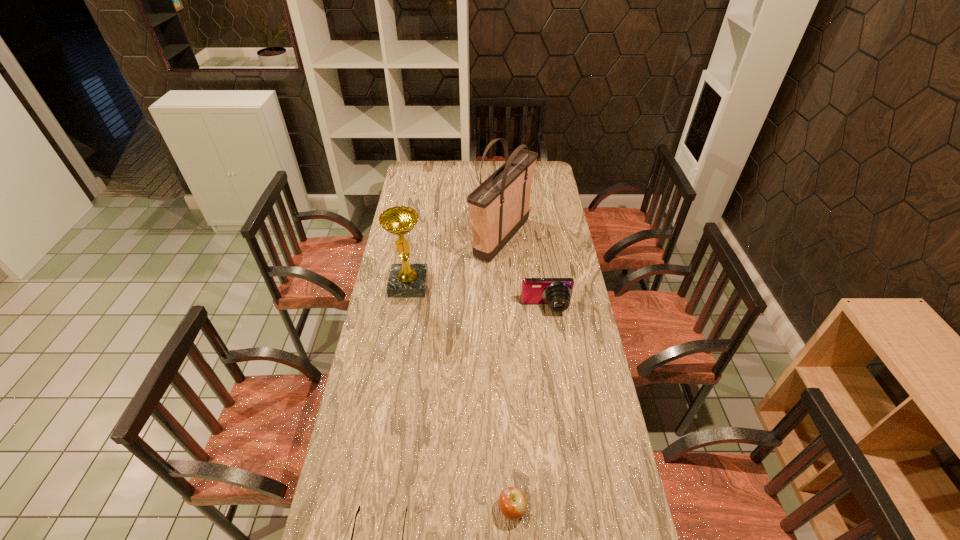
Where is `vacant space situated on the back of the second shortest object`? The height and width of the screenshot is (540, 960). vacant space situated on the back of the second shortest object is located at coordinates (511, 470).

I want to click on object that is at the left edge, so click(406, 280).

The width and height of the screenshot is (960, 540). Find the location of `object that is at the right edge`. object that is at the right edge is located at coordinates (556, 292).

This screenshot has width=960, height=540. I want to click on free space at the far edge, so click(436, 167).

Where is `vacant space at the left edge`? The image size is (960, 540). vacant space at the left edge is located at coordinates (414, 260).

This screenshot has width=960, height=540. I want to click on free space at the right edge, so click(600, 392).

In the image, there is a desktop. Identify the location of vacant space at the far left corner. Image resolution: width=960 pixels, height=540 pixels. (408, 172).

The image size is (960, 540). Find the location of `unoccupied position between the third farthest object and the tallest object`. unoccupied position between the third farthest object and the tallest object is located at coordinates (524, 273).

Where is `vacant point located between the farthest object and the second tallest object`? vacant point located between the farthest object and the second tallest object is located at coordinates (455, 261).

Where is `empty location between the apple and the farthest object`? This screenshot has width=960, height=540. empty location between the apple and the farthest object is located at coordinates (507, 374).